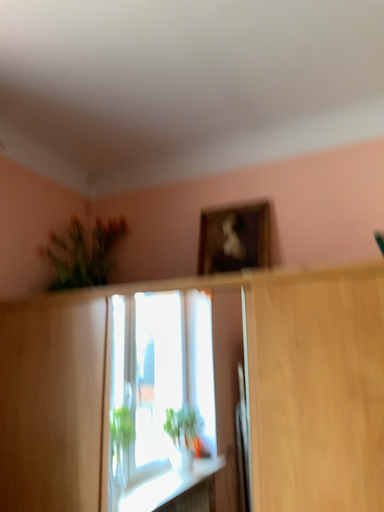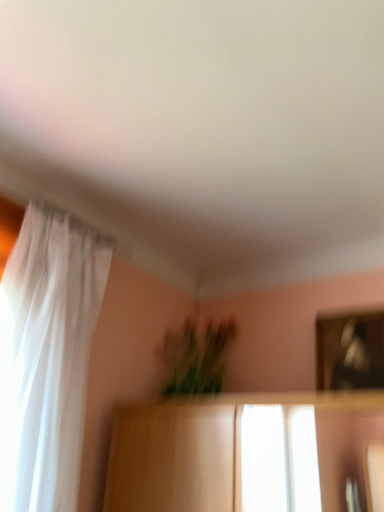
Question: Which way did the camera rotate in the video?

Choices:
 (A) rotated right
 (B) rotated left

Answer: (B)